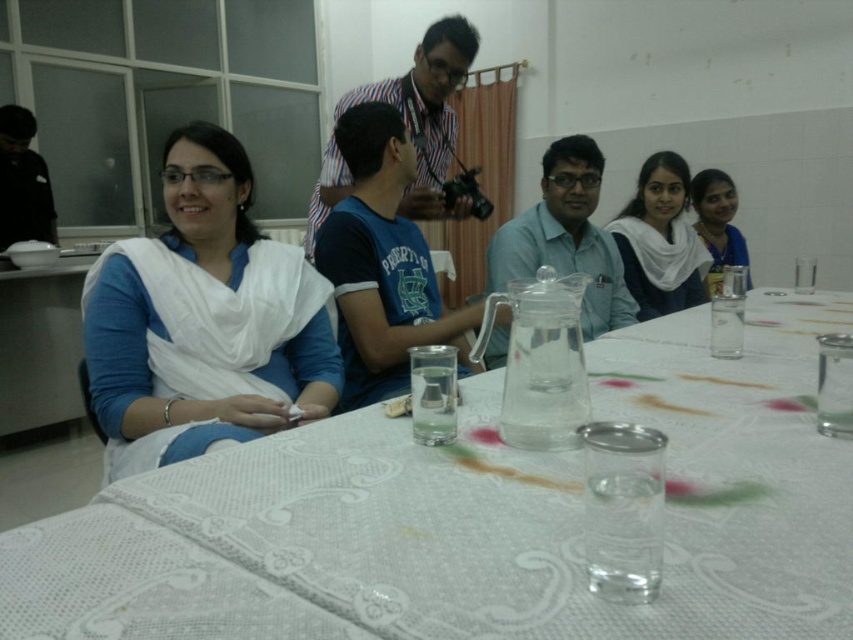
Between point (103, 289) and point (503, 234), which one is positioned in front?

Point (103, 289) is in front.

Is white fabric at center bigger than matte glass pitcher at center?

No.

Where is `white fabric at center`? This screenshot has width=853, height=640. white fabric at center is located at coordinates (202, 321).

This screenshot has height=640, width=853. Describe the element at coordinates (474, 516) in the screenshot. I see `white lace tablecloth at center` at that location.

Between white lace tablecloth at center and matte glass pitcher at center, which one appears on the left side from the viewer's perspective?

Positioned to the left is matte glass pitcher at center.

Which is in front, point (577, 604) or point (514, 218)?

Point (577, 604)

Image resolution: width=853 pixels, height=640 pixels. What are the coordinates of `white lace tablecloth at center` in the screenshot? It's located at (474, 516).

Is matte glass pitcher at center thinner than white scarf at center?

In fact, matte glass pitcher at center might be wider than white scarf at center.

Between matte glass pitcher at center and white scarf at center, which one has less height?

white scarf at center

Is point (558, 147) farther from viewer compared to point (689, 266)?

No.

You are a GUI agent. You are given a task and a screenshot of the screen. Output one action in this format:
    pyautogui.click(x=<x>, y=<y>)
    Task: Click on the matte glass pitcher at center
    Image resolution: width=853 pixels, height=640 pixels.
    Given the screenshot: What is the action you would take?
    pyautogui.click(x=566, y=237)